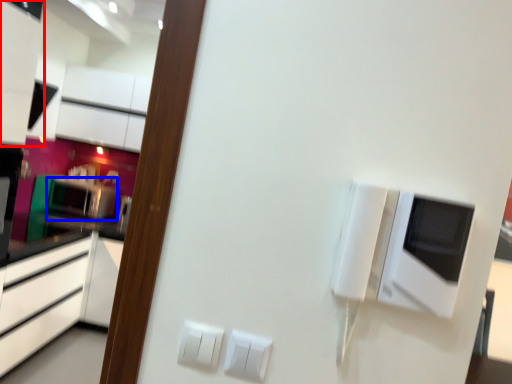
Question: Which object is closer to the camera taking this photo, cabinetry (highlighted by a red box) or appliance (highlighted by a blue box)?

Choices:
 (A) cabinetry
 (B) appliance

Answer: (A)